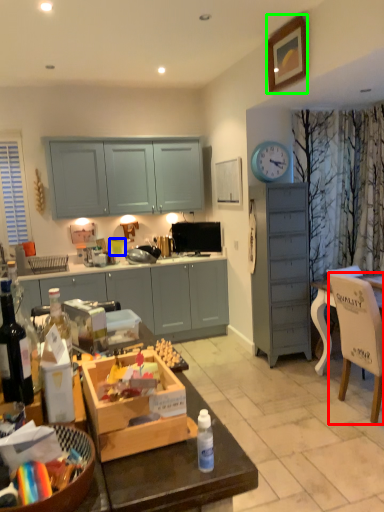
Question: Considering the real-world distances, which object is farthest from chair (highlighted by a red box)? coffee cup (highlighted by a blue box) or picture frame (highlighted by a green box)?

Choices:
 (A) coffee cup
 (B) picture frame

Answer: (A)